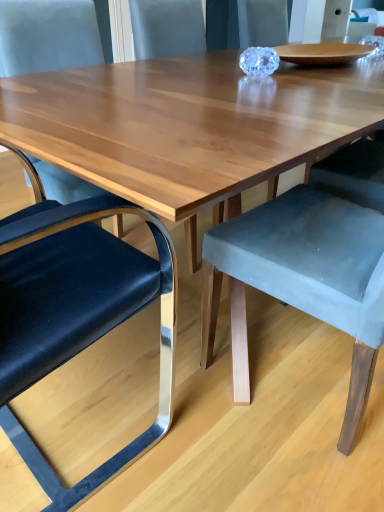
Question: Should I look upward or downward to see velvet grey chair at center, which is counted as the third chair, starting from the left?

Choices:
 (A) down
 (B) up

Answer: (B)

Question: Is velvet blue chair at left, which is counted as the second chair, starting from the left, positioned in front of metallic blue cushioned chair at left, which ranks as the third chair in right-to-left order?

Choices:
 (A) yes
 (B) no

Answer: (B)

Question: From the image's perspective, is velvet blue chair at left, acting as the 2th chair starting from the right, located beneath metallic blue cushioned chair at left, which ranks as the third chair in right-to-left order?

Choices:
 (A) no
 (B) yes

Answer: (A)

Question: Can you confirm if velvet blue chair at left, acting as the 2th chair starting from the right, is thinner than metallic blue cushioned chair at left, which ranks as the third chair in right-to-left order?

Choices:
 (A) no
 (B) yes

Answer: (A)

Question: From a real-world perspective, is velvet blue chair at left, which is counted as the second chair, starting from the left, positioned over metallic blue cushioned chair at left, which ranks as the third chair in right-to-left order, based on gravity?

Choices:
 (A) no
 (B) yes

Answer: (B)

Question: Can you confirm if velvet blue chair at left, which is counted as the second chair, starting from the left, is positioned to the right of metallic blue cushioned chair at left, the 1th chair from the left?

Choices:
 (A) yes
 (B) no

Answer: (A)

Question: Can you confirm if velvet blue chair at left, acting as the 2th chair starting from the right, is taller than metallic blue cushioned chair at left, which ranks as the third chair in right-to-left order?

Choices:
 (A) no
 (B) yes

Answer: (B)

Question: Does velvet grey chair at center, which appears as the 1th chair when viewed from the right, have a larger size compared to velvet blue chair at left, which is counted as the second chair, starting from the left?

Choices:
 (A) yes
 (B) no

Answer: (A)

Question: Is velvet grey chair at center, which appears as the 1th chair when viewed from the right, smaller than velvet blue chair at left, acting as the 2th chair starting from the right?

Choices:
 (A) yes
 (B) no

Answer: (B)

Question: Does velvet grey chair at center, which is counted as the third chair, starting from the left, have a lesser width compared to velvet blue chair at left, acting as the 2th chair starting from the right?

Choices:
 (A) no
 (B) yes

Answer: (A)

Question: Is velvet grey chair at center, which is counted as the third chair, starting from the left, behind velvet blue chair at left, which is counted as the second chair, starting from the left?

Choices:
 (A) no
 (B) yes

Answer: (A)

Question: Is velvet grey chair at center, which appears as the 1th chair when viewed from the right, oriented away from velvet blue chair at left, which is counted as the second chair, starting from the left?

Choices:
 (A) yes
 (B) no

Answer: (B)

Question: Is there a large distance between velvet grey chair at center, which is counted as the third chair, starting from the left, and velvet blue chair at left, which is counted as the second chair, starting from the left?

Choices:
 (A) yes
 (B) no

Answer: (A)

Question: Can you confirm if metallic blue cushioned chair at left, which ranks as the third chair in right-to-left order, is bigger than velvet grey chair at center, which appears as the 1th chair when viewed from the right?

Choices:
 (A) yes
 (B) no

Answer: (A)